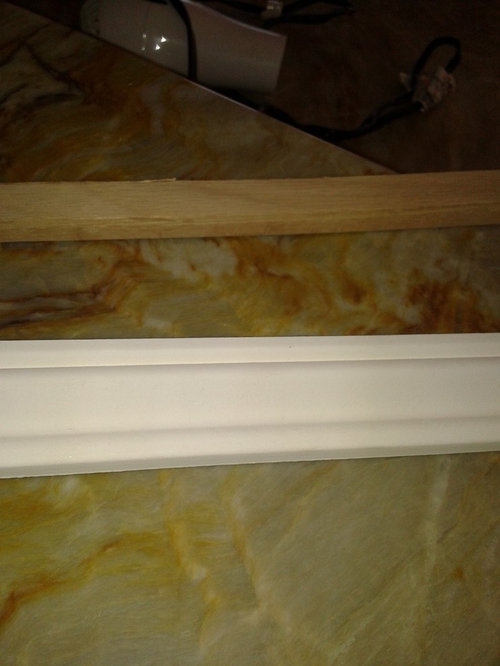
This screenshot has width=500, height=666. In order to click on black cable in this screenshot , I will do `click(396, 112)`.